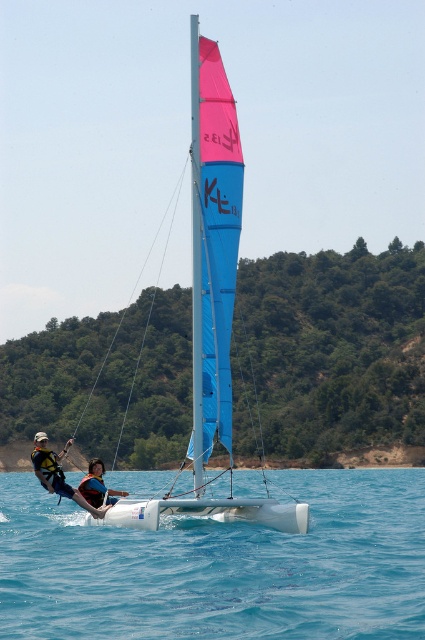
You are standing on a dock 30 meters away from the blue glossy sail at center. Can you safely walk towards the sail without getting wet?

The blue glossy sail at center is 26.22 meters from the viewer. Since you are standing on a dock 30 meters away from it, you are farther away than the sail. Therefore, walking towards the sail would require moving closer, but the distance alone doesn

You are standing on the deck of the catamaran and want to jump into the water. There is a point marked at coordinates [220,566]. Is the area at this point clear of any obstacles, making it safe to jump?

The area at point [220,566] is clear blue water at center, so it is safe to jump there as there are no obstacles.

You are a photographer trying to capture a clear shot of the white life vest at lower left. However, the blue glossy sail at center is blocking your view. Can you adjust your position to avoid the sail?

The blue glossy sail at center is in front of the white life vest at lower left, so moving your position behind the sail or to the side might allow you to see the white life vest at lower left without obstruction.